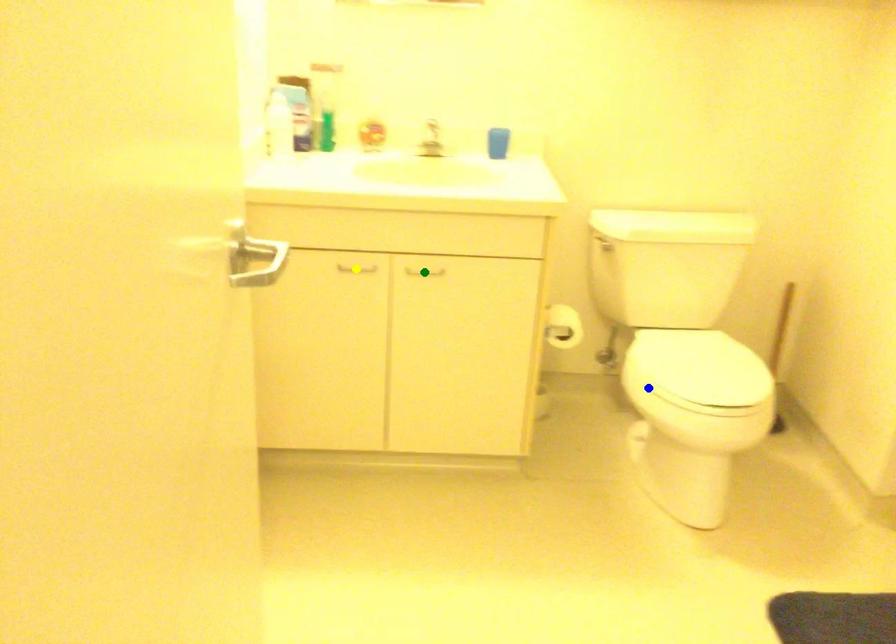
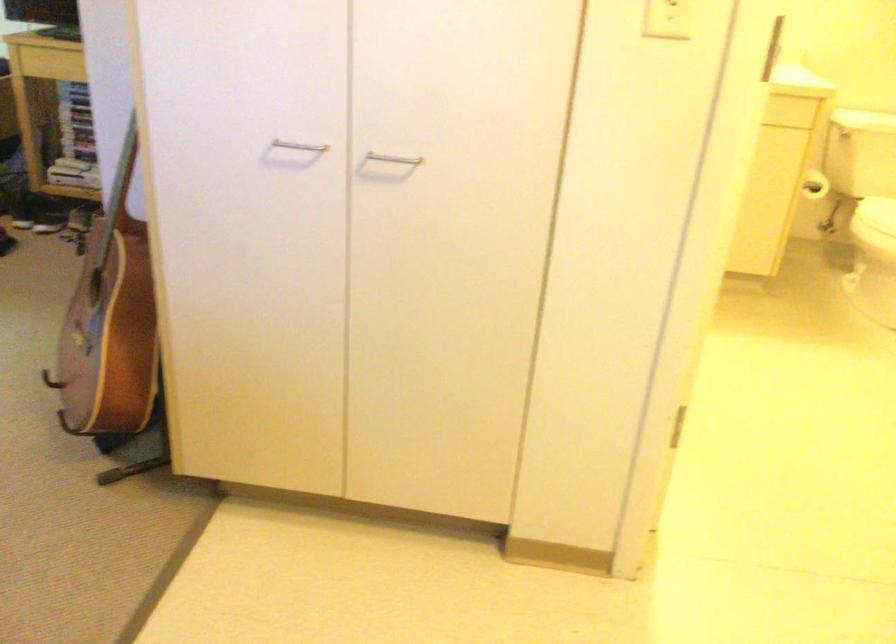
I am providing you with two images of the same scene from different viewpoints. Three points are marked in image1. Which point corresponds to a part or object that is occluded in image2?In image1, three points are marked. Which of them correspond to a part or object that is occluded in image2?Among the three points shown in image1, which one corresponds to a part or object that is no longer visible due to occlusion in image2?

Invisible in image2: yellow point, green point.